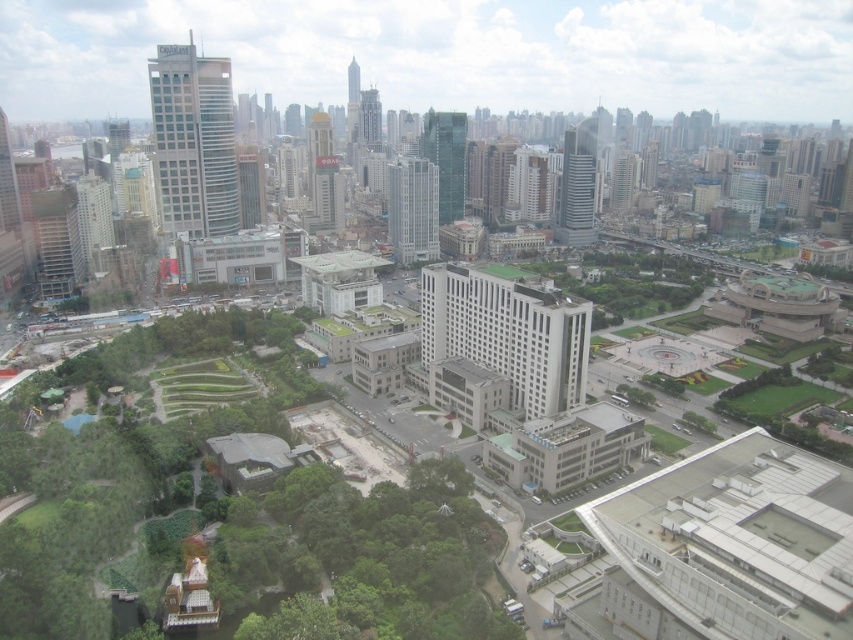
Question: Is glassy silver skyscraper at center-right to the left of glassy steel skyscraper at center from the viewer's perspective?

Choices:
 (A) no
 (B) yes

Answer: (A)

Question: Is green leafy tree at lower left behind glassy teal skyscraper at center?

Choices:
 (A) no
 (B) yes

Answer: (A)

Question: Estimate the real-world distances between objects in this image. Which object is closer to the matte gray building at left?

Choices:
 (A) glassy steel skyscraper at center
 (B) silver glass skyscraper at upper left
 (C) glassy steel skyscraper at upper center

Answer: (B)

Question: Can you confirm if green leafy tree at lower left is wider than glassy silver skyscraper at center-right?

Choices:
 (A) no
 (B) yes

Answer: (A)

Question: Which point is farther from the camera taking this photo?

Choices:
 (A) (613, 312)
 (B) (566, 372)

Answer: (A)

Question: Which object appears farthest from the camera in this image?

Choices:
 (A) glassy silver skyscraper at center-right
 (B) green leafy trees at center
 (C) gold reflective tower at center

Answer: (A)